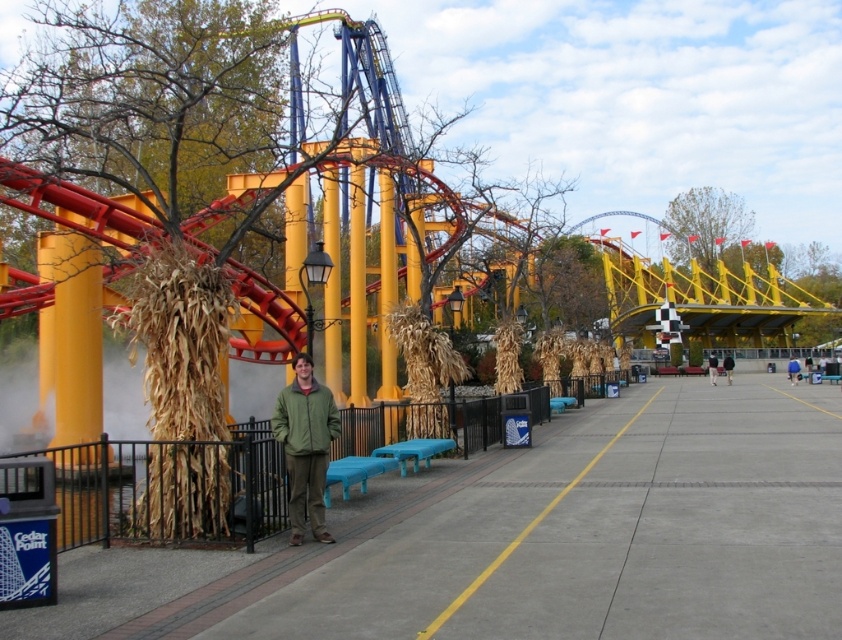
In the scene shown: Who is more distant from viewer, (301, 474) or (793, 369)?

Point (793, 369)

Is green fleece jacket at center smaller than blue fabric jacket at center?

Yes.

This screenshot has width=842, height=640. In order to click on green fleece jacket at center in this screenshot , I will do `click(305, 445)`.

Does blue fabric jacket at center lie behind dark blue jeans at center?

That is False.

Which of these two, blue fabric jacket at center or dark blue jeans at center, stands shorter?

With less height is blue fabric jacket at center.

What do you see at coordinates (793, 369) in the screenshot? I see `blue fabric jacket at center` at bounding box center [793, 369].

The width and height of the screenshot is (842, 640). In order to click on blue fabric jacket at center in this screenshot , I will do `click(793, 369)`.

Does blue fabric jacket at center come in front of dark brown leather jacket at center?

Yes.

Who is more distant from viewer, (793,372) or (729,364)?

The point (729,364) is behind.

This screenshot has height=640, width=842. I want to click on blue fabric jacket at center, so click(x=793, y=369).

Where is `blue fabric jacket at center`? This screenshot has height=640, width=842. blue fabric jacket at center is located at coordinates (793, 369).